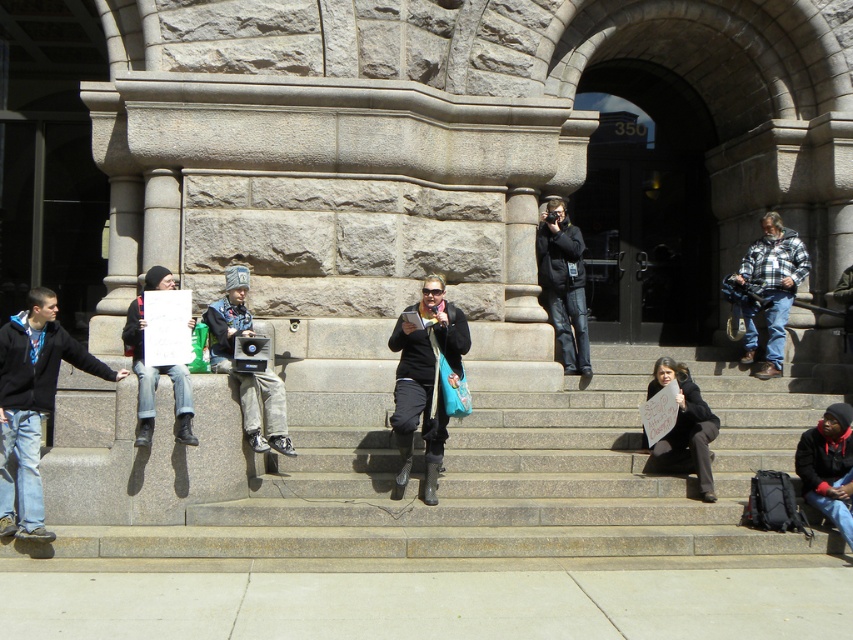
Question: Which object is closer to the camera taking this photo?

Choices:
 (A) matte black jacket at left
 (B) black leather jacket at center

Answer: (A)

Question: Which point is closer to the camera taking this photo?

Choices:
 (A) (170, 285)
 (B) (428, 426)
 (C) (683, 420)
 (D) (550, 310)

Answer: (B)

Question: Is matte black laptop at center further to camera compared to matte black jacket at left?

Choices:
 (A) no
 (B) yes

Answer: (B)

Question: Is dark blue hoodie at left positioned in front of black matte jacket at center?

Choices:
 (A) yes
 (B) no

Answer: (A)

Question: Can you confirm if black fleece jacket at lower right is positioned above matte black jacket at left?

Choices:
 (A) yes
 (B) no

Answer: (B)

Question: Estimate the real-world distances between objects in this image. Which object is closer to the granite steps at center?

Choices:
 (A) plaid flannel shirt at right
 (B) matte black laptop at center
 (C) black matte jacket at center

Answer: (B)